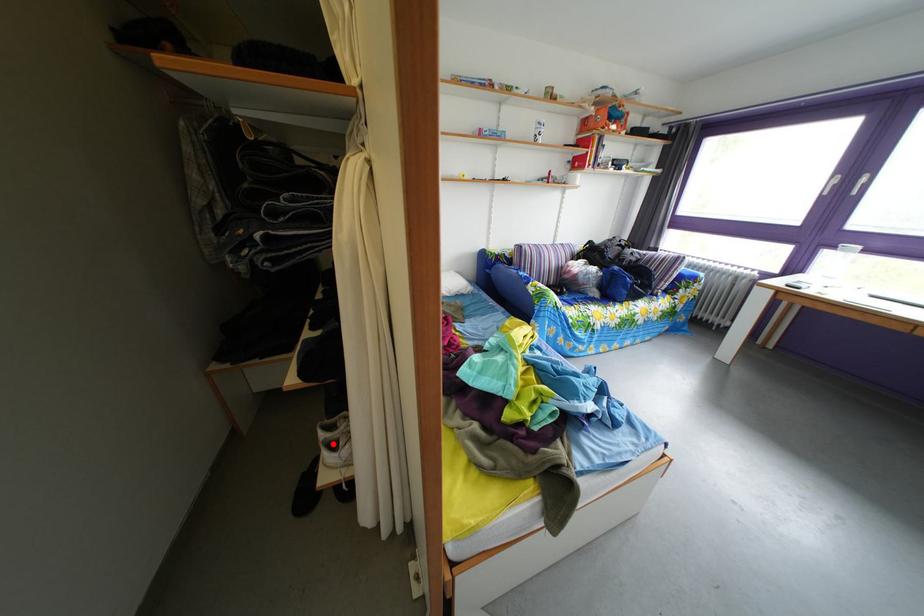
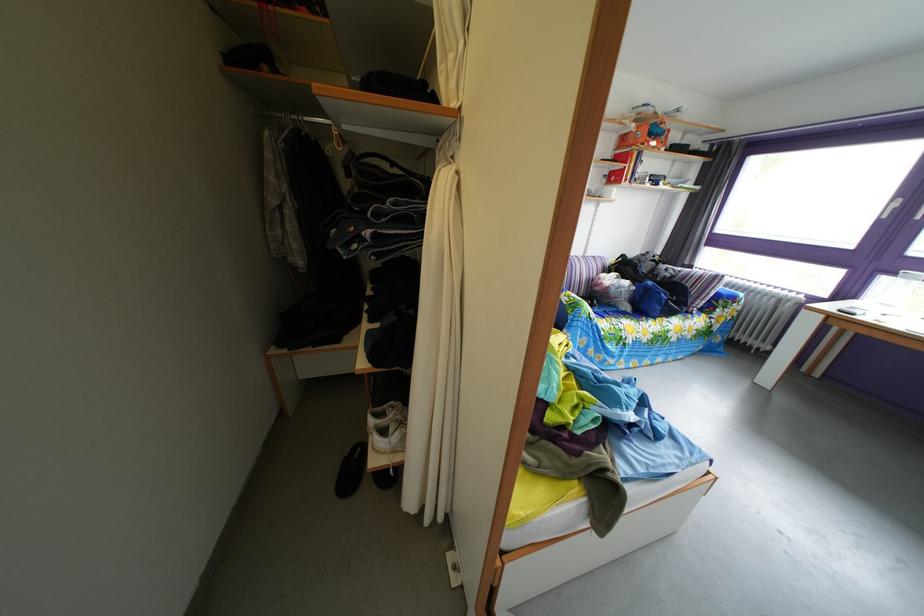
Question: I am providing you with two images of the same scene from different viewpoints. Image1 has a red point marked. In image2, the corresponding 3D location appears at what relative position? Reply with the corresponding letter.

Choices:
 (A) Closer
 (B) Farther

Answer: (A)